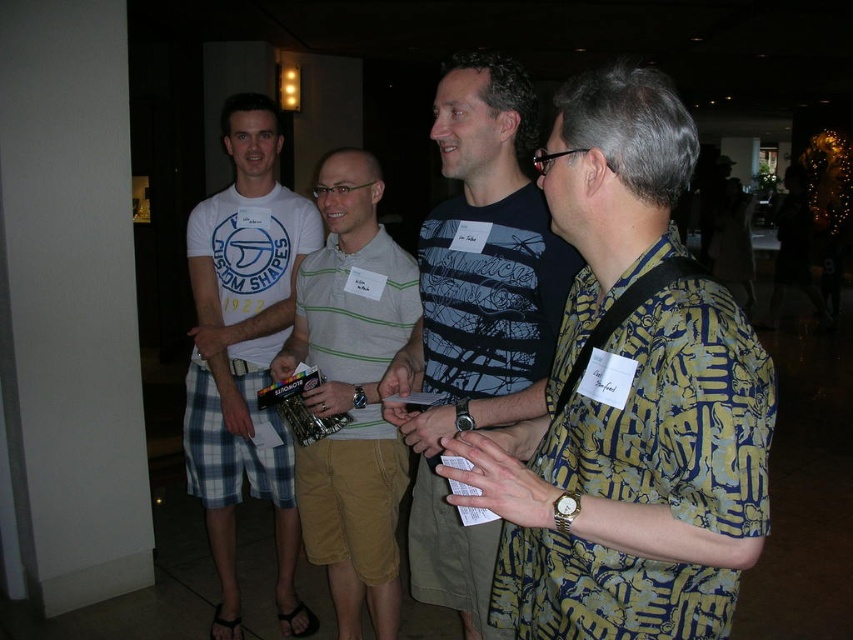
Question: Which is nearer to the yellow printed shirt at center?

Choices:
 (A) white t-shirt at left
 (B) striped cotton polo shirt at center
 (C) dark blue striped shirt at center

Answer: (C)

Question: Considering the relative positions of dark blue striped shirt at center and striped cotton polo shirt at center in the image provided, where is dark blue striped shirt at center located with respect to striped cotton polo shirt at center?

Choices:
 (A) below
 (B) above

Answer: (B)

Question: Does dark blue striped shirt at center appear over striped cotton polo shirt at center?

Choices:
 (A) no
 (B) yes

Answer: (B)

Question: Which point is farther to the camera?

Choices:
 (A) dark blue striped shirt at center
 (B) striped cotton polo shirt at center
 (C) white t-shirt at left
 (D) yellow printed shirt at center

Answer: (C)

Question: Does dark blue striped shirt at center appear over striped cotton polo shirt at center?

Choices:
 (A) yes
 (B) no

Answer: (A)

Question: Which object is farther from the camera taking this photo?

Choices:
 (A) dark blue striped shirt at center
 (B) striped cotton polo shirt at center

Answer: (B)